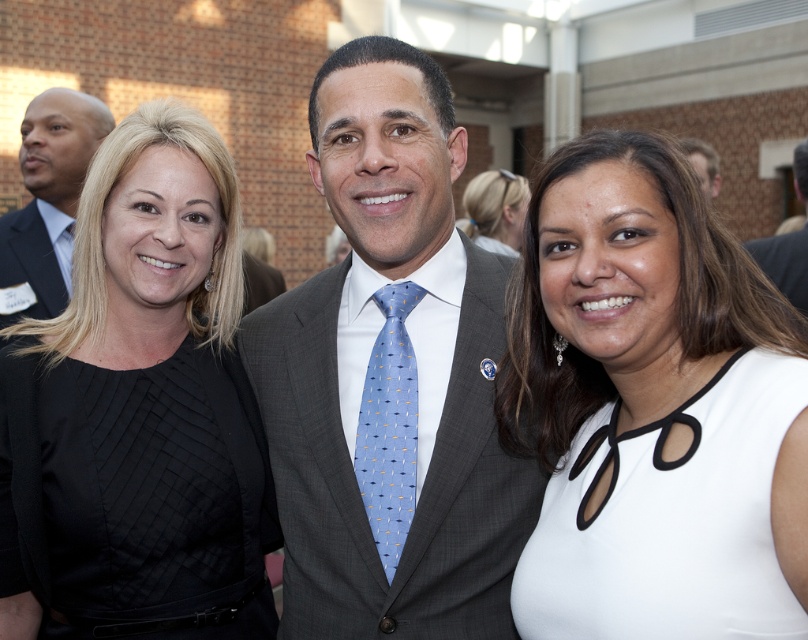
You are a photographer at the event and need to adjust the lighting to ensure both the matte black suit at left and the dark gray suit at left are well lit. Considering their heights, which suit will require the light to be positioned higher to avoid shadows on their face?

The matte black suit at left is much taller as dark gray suit at left, so the light should be positioned higher for the matte black suit at left to avoid shadows on their face.

What is located at the coordinate point (x=28, y=262) in the image?

The dark gray suit at left is located at point (x=28, y=262).

You are a photographer at a formal event and need to adjust the lighting for two individuals wearing dark gray suit at left and matte gray suit at center. Which person should receive more light to ensure their outfit doesn

The dark gray suit at left is bigger than the matte gray suit at center, so the person wearing the dark gray suit at left may require more light to ensure the larger garment is properly illuminated and details are visible.